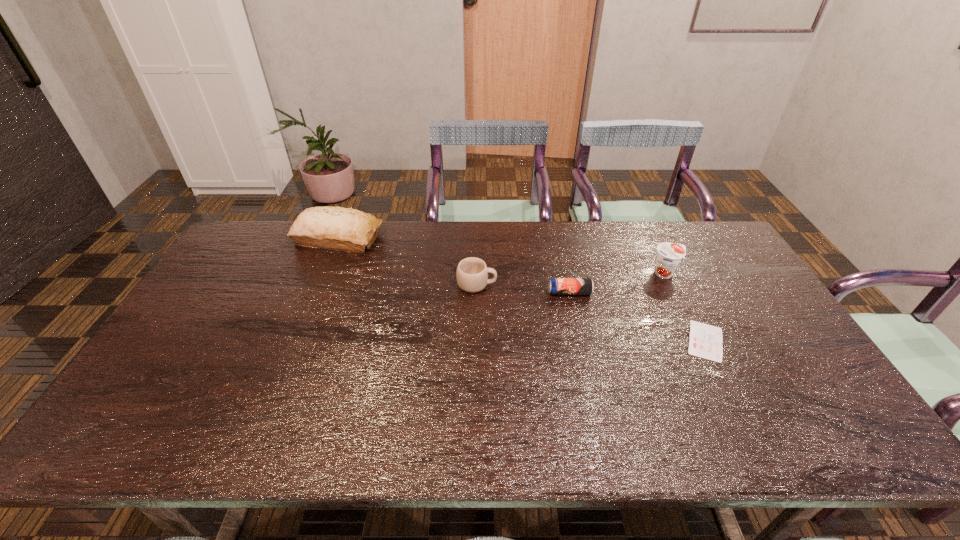
Where is `the farthest object`? the farthest object is located at coordinates (335, 228).

This screenshot has height=540, width=960. Find the location of `the leftmost object`. the leftmost object is located at coordinates (335, 228).

Image resolution: width=960 pixels, height=540 pixels. Identify the location of the fourth shortest object. (669, 255).

The image size is (960, 540). I want to click on the third shortest object, so click(472, 273).

Find the location of a particular element. The height and width of the screenshot is (540, 960). the second object from left to right is located at coordinates (472, 273).

Where is `beer can`? beer can is located at coordinates (557, 286).

Locate an element on the screen. the second shortest object is located at coordinates (557, 286).

What are the coordinates of `the shortest object` in the screenshot? It's located at (705, 341).

Locate an element on the screen. diary is located at coordinates (705, 341).

Locate an element on the screen. vacant point located 0.200m on the right of the bread is located at coordinates (439, 238).